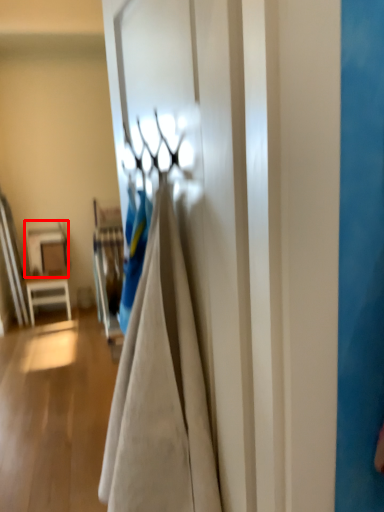
Question: From the image's perspective, what is the correct spatial relationship of table (annotated by the red box) in relation to door?

Choices:
 (A) above
 (B) below

Answer: (B)